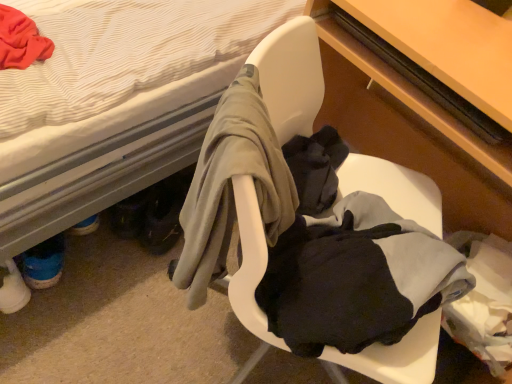
Question: Can you confirm if wooden table at right is bigger than matte wood desk at center?

Choices:
 (A) no
 (B) yes

Answer: (A)

Question: Is wooden table at right aimed at matte wood desk at center?

Choices:
 (A) yes
 (B) no

Answer: (A)

Question: Is wooden table at right shorter than matte wood desk at center?

Choices:
 (A) no
 (B) yes

Answer: (B)

Question: Is wooden table at right turned away from matte wood desk at center?

Choices:
 (A) no
 (B) yes

Answer: (B)

Question: From a real-world perspective, is wooden table at right physically below matte wood desk at center?

Choices:
 (A) yes
 (B) no

Answer: (B)

Question: In terms of width, does wooden table at right look wider or thinner when compared to white plastic chair at center?

Choices:
 (A) thin
 (B) wide

Answer: (A)

Question: From the image's perspective, is wooden table at right positioned above or below white plastic chair at center?

Choices:
 (A) below
 (B) above

Answer: (B)

Question: In the image, is wooden table at right on the left side or the right side of white plastic chair at center?

Choices:
 (A) right
 (B) left

Answer: (A)

Question: Considering the positions of point (454, 140) and point (391, 372), is point (454, 140) closer or farther from the camera than point (391, 372)?

Choices:
 (A) closer
 (B) farther

Answer: (B)

Question: From the image's perspective, is matte wood desk at center above or below white plastic chair at center?

Choices:
 (A) below
 (B) above

Answer: (B)

Question: From a real-world perspective, is matte wood desk at center positioned above or below white plastic chair at center?

Choices:
 (A) above
 (B) below

Answer: (A)

Question: Looking at their shapes, would you say matte wood desk at center is wider or thinner than white plastic chair at center?

Choices:
 (A) wide
 (B) thin

Answer: (B)

Question: Is matte wood desk at center in front of or behind white plastic chair at center in the image?

Choices:
 (A) front
 (B) behind

Answer: (B)

Question: From the image's perspective, is white plastic chair at center positioned above or below matte wood desk at center?

Choices:
 (A) above
 (B) below

Answer: (B)

Question: Looking at the image, does white plastic chair at center seem bigger or smaller compared to matte wood desk at center?

Choices:
 (A) big
 (B) small

Answer: (A)